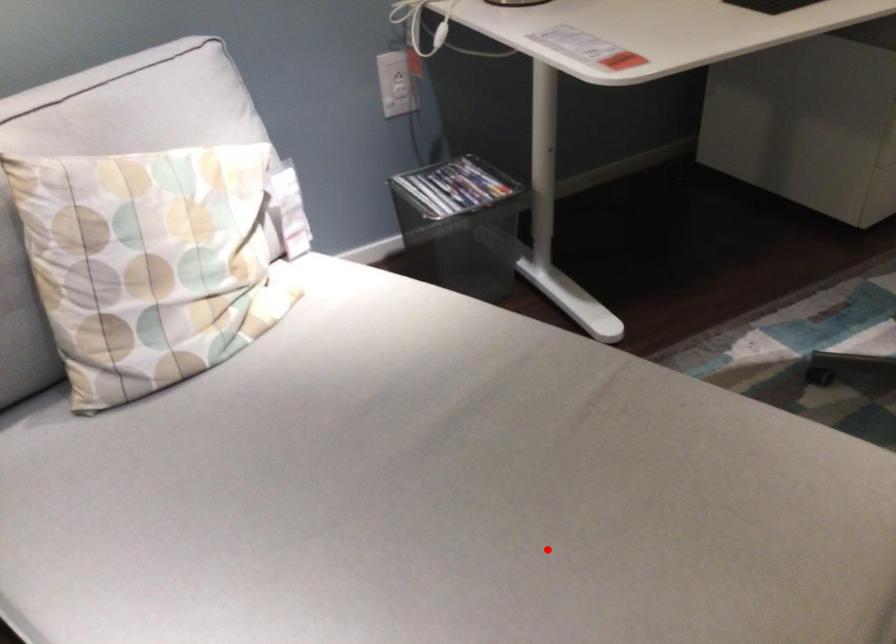
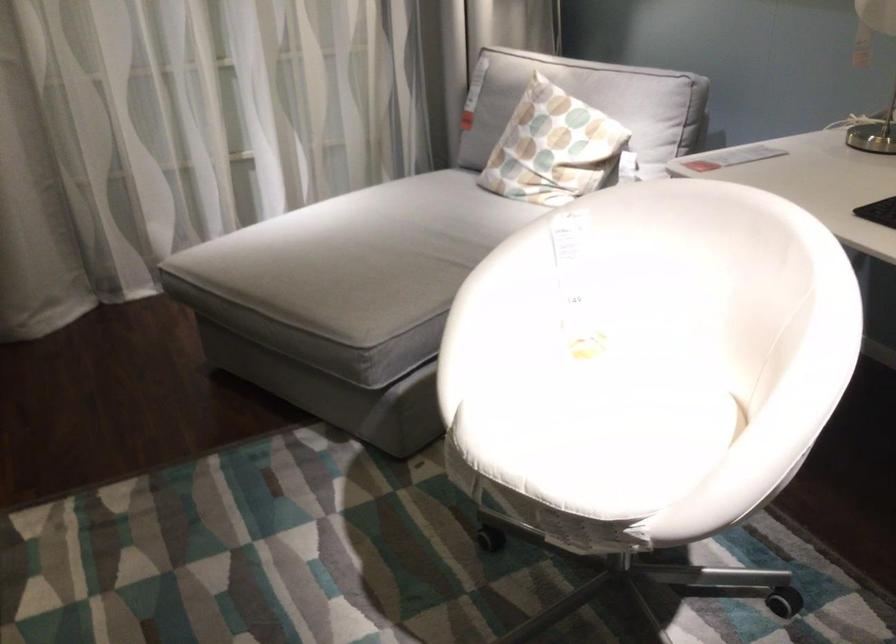
Find the pixel in the second image that matches the highlighted location in the first image.

(359, 256)